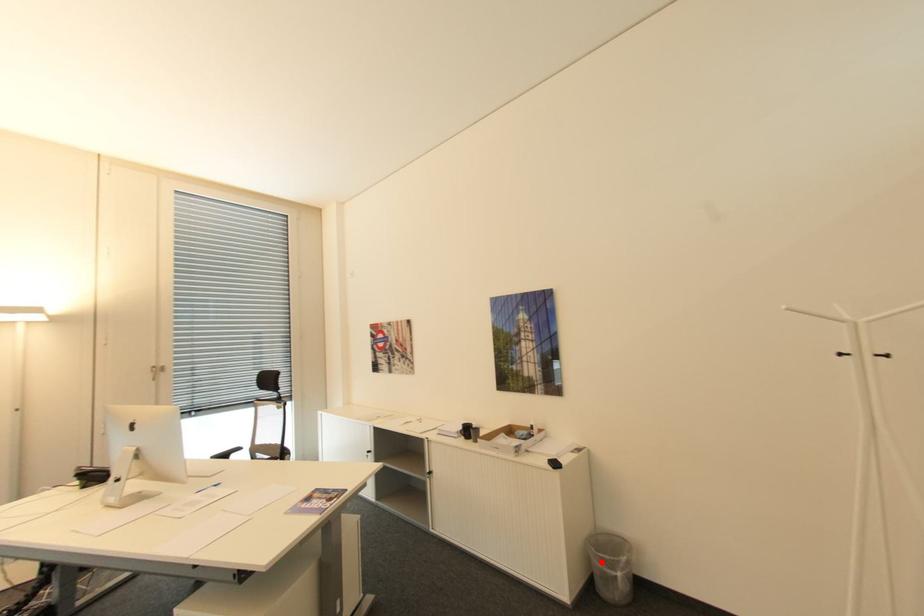
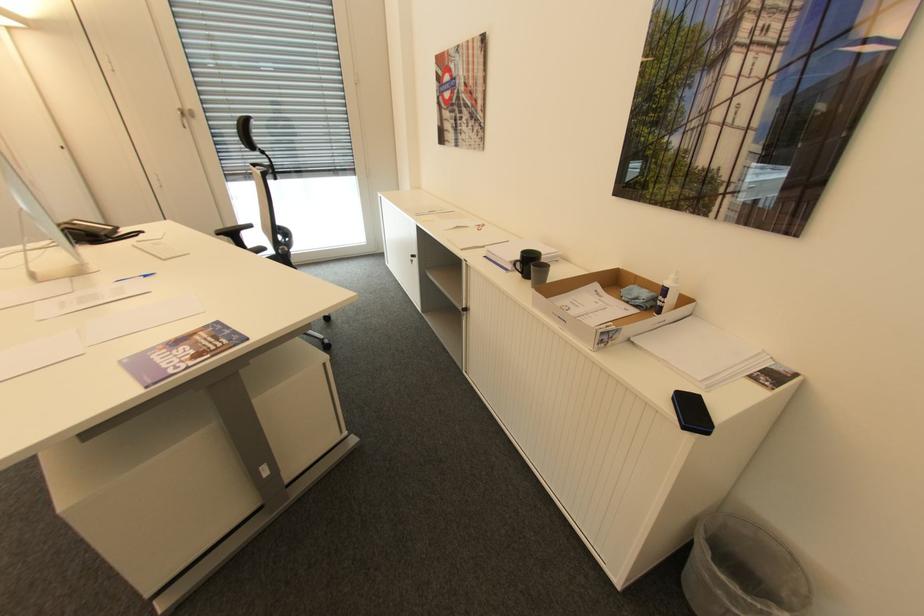
Locate, in the second image, the point that corresponds to the highlighted location in the first image.

(711, 576)